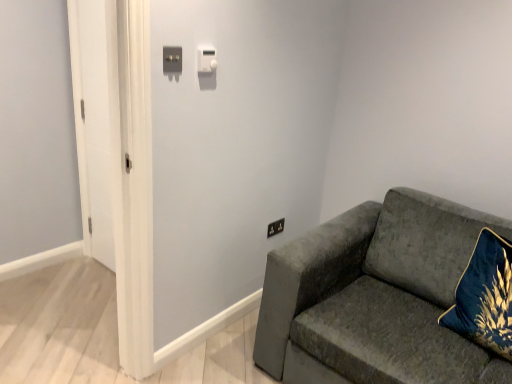
Find the location of `free location in front of white glossy door at left`. free location in front of white glossy door at left is located at coordinates (86, 283).